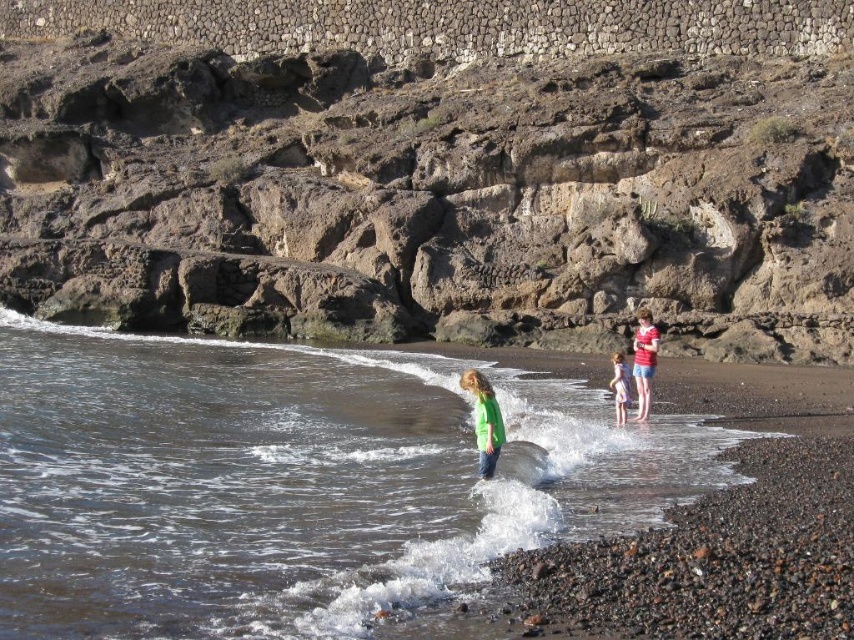
Question: Which point appears closest to the camera in this image?

Choices:
 (A) click(x=255, y=33)
 (B) click(x=642, y=381)

Answer: (B)

Question: Can you confirm if green matte shirt at center is thinner than light pink fabric dress at lower right?

Choices:
 (A) yes
 (B) no

Answer: (A)

Question: Which point is farther to the camera?

Choices:
 (A) green matte shirt at center
 (B) matte red shirt at center
 (C) brown rocky cliff at upper center
 (D) rustic stone wall at upper center

Answer: (D)

Question: Observing the image, what is the correct spatial positioning of clear water at center in reference to rustic stone wall at upper center?

Choices:
 (A) below
 (B) above

Answer: (A)

Question: Is brown rocky cliff at upper center smaller than green matte shirt at center?

Choices:
 (A) no
 (B) yes

Answer: (A)

Question: Which object is farther from the camera taking this photo?

Choices:
 (A) light pink fabric dress at lower right
 (B) matte red shirt at center
 (C) clear water at center
 (D) brown rocky cliff at upper center

Answer: (D)